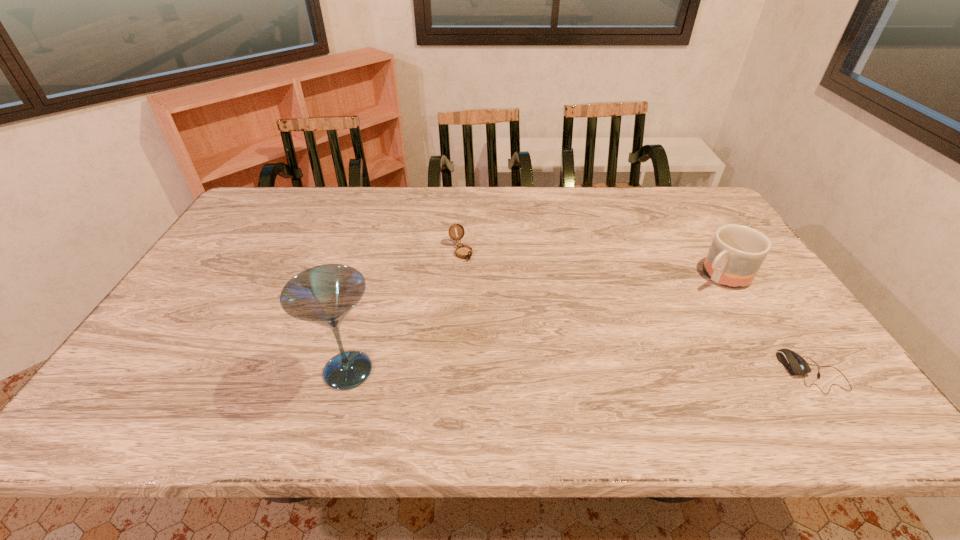
Find the location of `the tallest object`. the tallest object is located at coordinates (324, 295).

I want to click on the leftmost object, so click(324, 295).

The image size is (960, 540). I want to click on computer mouse, so click(796, 365).

At what (x,y) coordinates should I click in order to perform the action: click on the second object from left to right. Please return your answer as a coordinate pair (x, y). The image size is (960, 540). Looking at the image, I should click on (463, 252).

You are a GUI agent. You are given a task and a screenshot of the screen. Output one action in this format:
    pyautogui.click(x=<x>, y=<y>)
    Task: Click on the second shortest object
    The width and height of the screenshot is (960, 540).
    Given the screenshot: What is the action you would take?
    pyautogui.click(x=463, y=252)

Identify the location of the second tallest object. (737, 252).

Find the location of a particular element. vacant space located 0.200m on the right of the martini is located at coordinates (469, 370).

Locate an element on the screen. This screenshot has width=960, height=540. blank space located on the left of the shortest object is located at coordinates tap(647, 372).

You are a GUI agent. You are given a task and a screenshot of the screen. Output one action in this format:
    pyautogui.click(x=<x>, y=<y>)
    Task: Click on the vacant space situated 0.180m on the face of the third tallest object
    This screenshot has width=960, height=540.
    Given the screenshot: What is the action you would take?
    pyautogui.click(x=492, y=301)

I want to click on free space located on the face of the third tallest object, so click(516, 336).